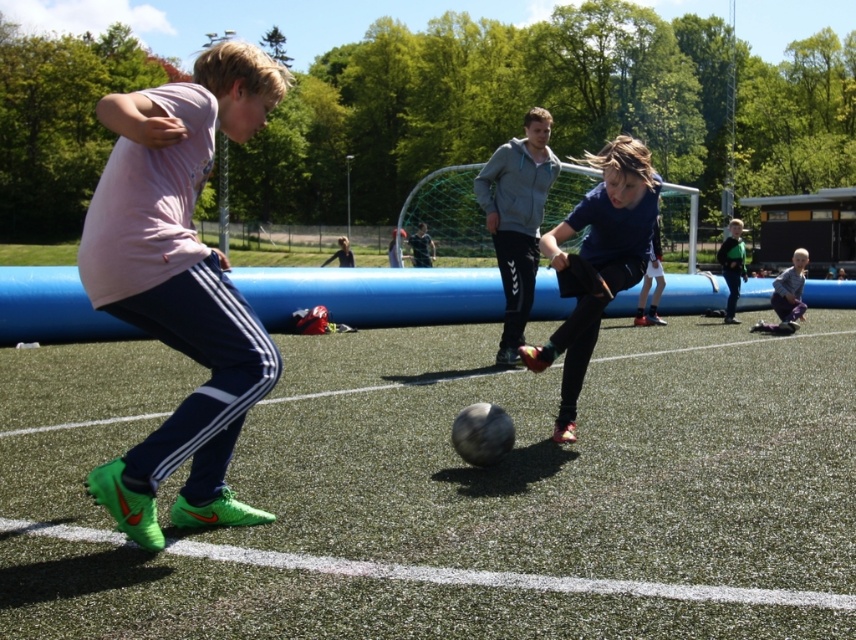
How far apart are matte blue shorts at center and light blue fabric pants at lower right?

They are 22.17 feet apart.

Does matte blue shorts at center appear under light blue fabric pants at lower right?

Yes.

Does point (589, 307) come behind point (749, 330)?

No, (589, 307) is closer to viewer.

Image resolution: width=856 pixels, height=640 pixels. In order to click on matte blue shorts at center in this screenshot , I will do `click(597, 262)`.